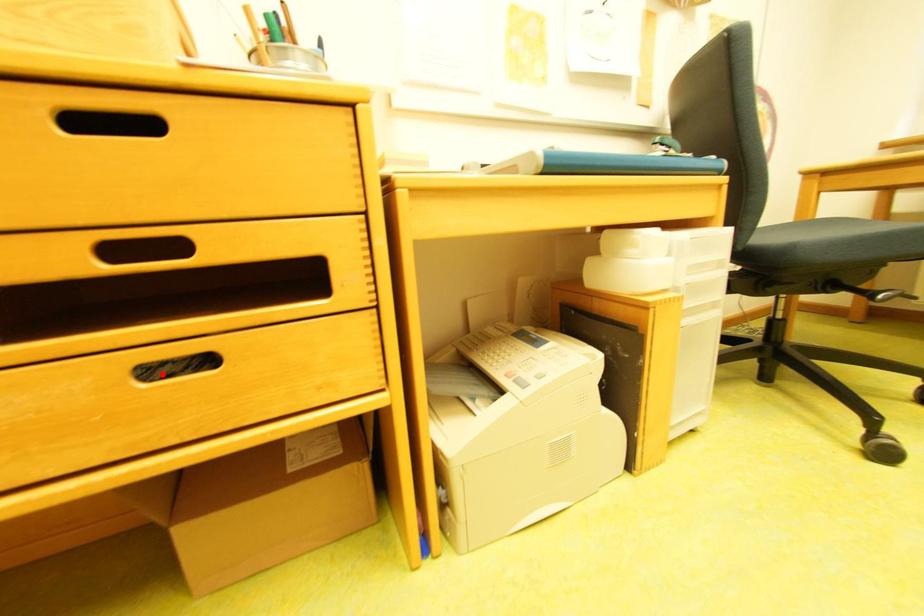
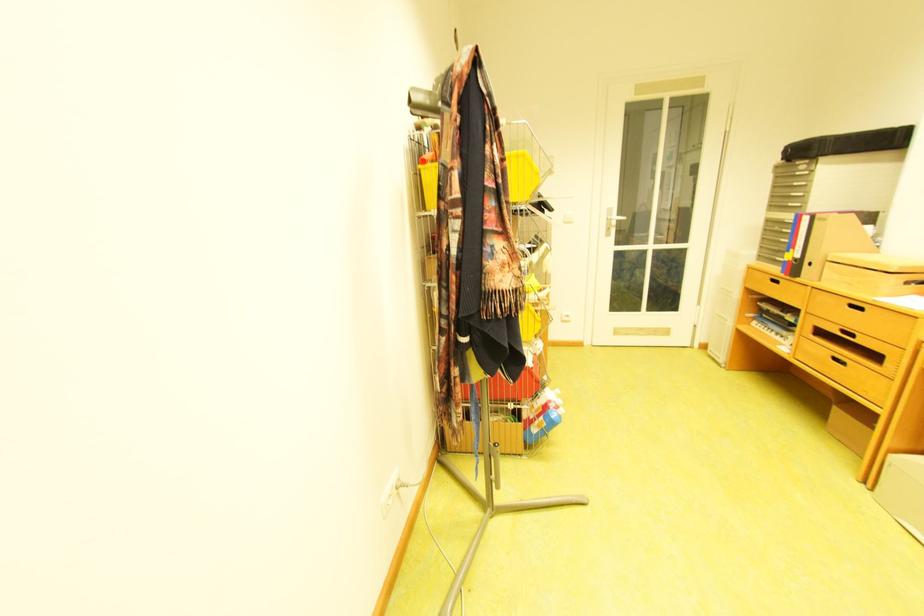
Locate, in the second image, the point that corresponds to the highlighted location in the first image.

(845, 360)